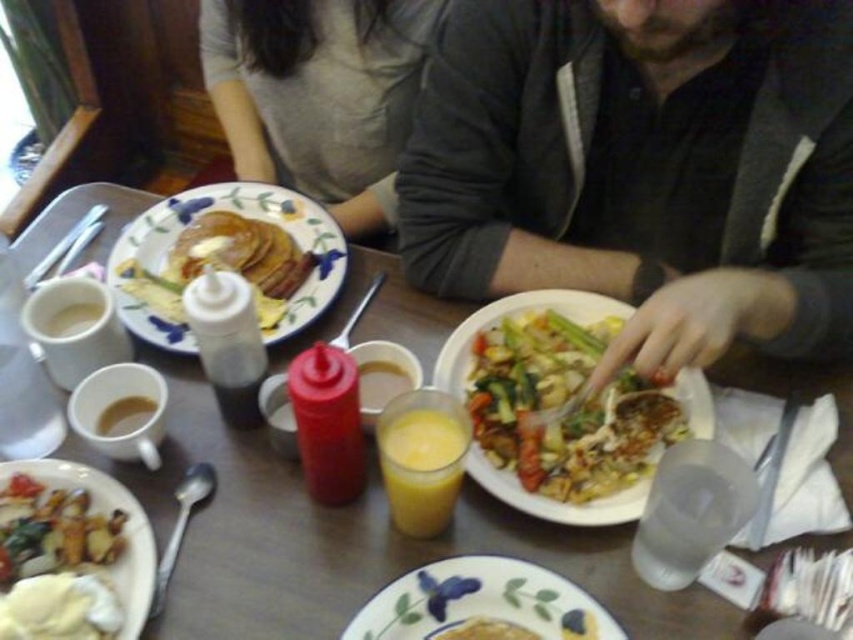
Between dark gray jacket at center and white ceramic plate at center, which one has more height?

dark gray jacket at center is taller.

Does point (657, 3) come in front of point (575, 593)?

No, it is not.

You are a GUI agent. You are given a task and a screenshot of the screen. Output one action in this format:
    pyautogui.click(x=<x>, y=<y>)
    Task: Click on the dark gray jacket at center
    This screenshot has width=853, height=640.
    Given the screenshot: What is the action you would take?
    pyautogui.click(x=642, y=168)

Is dark gray jacket at center shorter than translucent glass juice at center?

No.

Can you confirm if dark gray jacket at center is taller than translucent glass juice at center?

Indeed, dark gray jacket at center has a greater height compared to translucent glass juice at center.

Between point (785, 77) and point (408, 419), which one is positioned behind?

Point (785, 77)

Locate an element on the screen. This screenshot has width=853, height=640. dark gray jacket at center is located at coordinates (642, 168).

Looking at this image, is matte gray sweater at upper center positioned at the back of shiny silver fork at center?

Yes, it is.

Is matte gray sweater at upper center thinner than shiny silver fork at center?

No.

Is point (341, 205) more distant than point (622, 428)?

Yes, it is.

Identify the location of matte gray sweater at upper center. (318, 93).